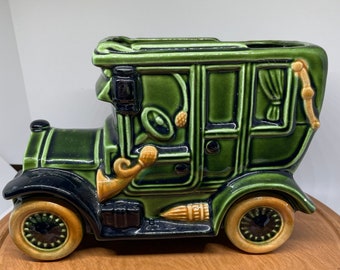
Where is `ceramic`? ceramic is located at coordinates (239, 140).